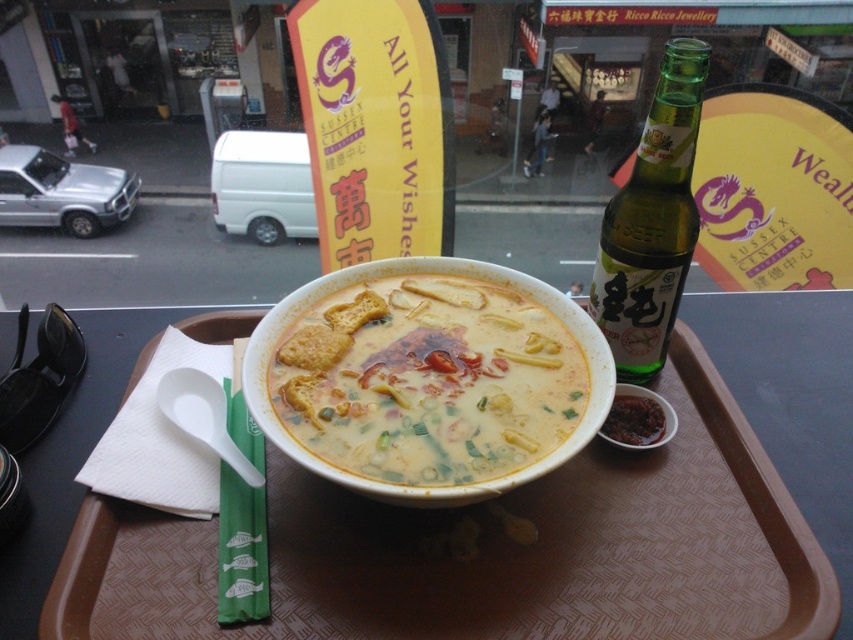
Can you confirm if brown plastic tray at center is shorter than green glass bottle at upper right?

Yes.

Where is `brown plastic tray at center`? Image resolution: width=853 pixels, height=640 pixels. brown plastic tray at center is located at coordinates (490, 552).

Where is `brown plastic tray at center`? brown plastic tray at center is located at coordinates (490, 552).

Does yellow creamy soup at center have a greater height compared to dark red paste at bowl right?

Yes, yellow creamy soup at center is taller than dark red paste at bowl right.

Does point (339, 355) come in front of point (613, 401)?

Yes, point (339, 355) is in front of point (613, 401).

This screenshot has width=853, height=640. Describe the element at coordinates (428, 380) in the screenshot. I see `yellow creamy soup at center` at that location.

Locate an element on the screen. The height and width of the screenshot is (640, 853). yellow creamy soup at center is located at coordinates (428, 380).

Between green glass bottle at upper right and dark red paste at bowl right, which one has less height?

dark red paste at bowl right is shorter.

Does green glass bottle at upper right appear on the left side of dark red paste at bowl right?

No, green glass bottle at upper right is not to the left of dark red paste at bowl right.

What do you see at coordinates (653, 221) in the screenshot? Image resolution: width=853 pixels, height=640 pixels. I see `green glass bottle at upper right` at bounding box center [653, 221].

The image size is (853, 640). I want to click on green glass bottle at upper right, so click(653, 221).